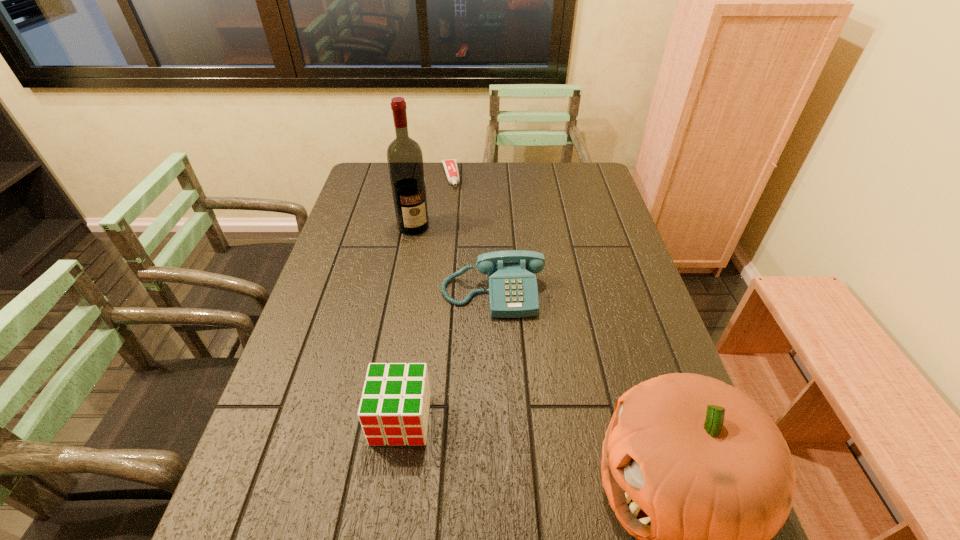
Where is `vacant space located on the front and back of the second farthest object`? This screenshot has height=540, width=960. vacant space located on the front and back of the second farthest object is located at coordinates (447, 295).

The height and width of the screenshot is (540, 960). I want to click on free space located 0.270m on the front and back of the second farthest object, so click(445, 291).

I want to click on vacant space located on the dial of the third farthest object, so click(506, 429).

The width and height of the screenshot is (960, 540). Find the location of `vacant space located 0.130m on the dial of the third farthest object`. vacant space located 0.130m on the dial of the third farthest object is located at coordinates (499, 360).

Find the location of a particular element. This screenshot has height=540, width=960. free space located on the dial of the third farthest object is located at coordinates 506,425.

Image resolution: width=960 pixels, height=540 pixels. I want to click on object situated at the far edge, so click(451, 168).

Identify the location of vacant space at the far edge. The width and height of the screenshot is (960, 540). (499, 181).

In order to click on vacant area at the near edge in this screenshot , I will do `click(538, 479)`.

You are a GUI agent. You are given a task and a screenshot of the screen. Output one action in this format:
    pyautogui.click(x=<x>, y=<y>)
    Task: Click on the free space at the left edge
    The width and height of the screenshot is (960, 540).
    Given the screenshot: What is the action you would take?
    pyautogui.click(x=289, y=372)

I want to click on free space at the right edge, so click(x=594, y=211).